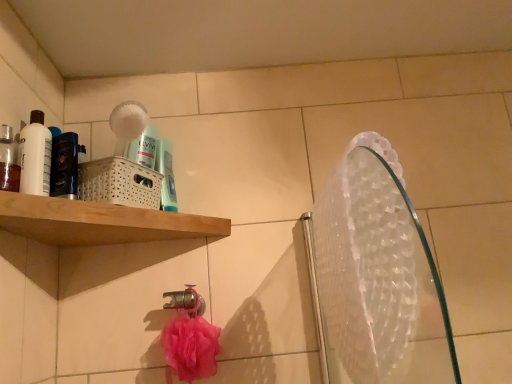
Question: Is translucent plastic mouthwash at left, which appears as the first mouthwash when viewed from the left, positioned with its back to transparent plastic mirror at upper right?

Choices:
 (A) no
 (B) yes

Answer: (A)

Question: Can you confirm if translucent plastic mouthwash at left, which appears as the first mouthwash when viewed from the left, is positioned to the left of transparent plastic mirror at upper right?

Choices:
 (A) yes
 (B) no

Answer: (A)

Question: Is translucent plastic mouthwash at left, which is counted as the 1th mouthwash, starting from the front, outside transparent plastic mirror at upper right?

Choices:
 (A) no
 (B) yes

Answer: (B)

Question: From the image's perspective, does translucent plastic mouthwash at left, which appears as the first mouthwash when viewed from the left, appear higher than transparent plastic mirror at upper right?

Choices:
 (A) no
 (B) yes

Answer: (B)

Question: Can you confirm if translucent plastic mouthwash at left, which appears as the first mouthwash when viewed from the left, is smaller than transparent plastic mirror at upper right?

Choices:
 (A) yes
 (B) no

Answer: (A)

Question: Considering the relative sizes of translucent plastic mouthwash at left, which is counted as the 1th mouthwash, starting from the front, and transparent plastic mirror at upper right in the image provided, is translucent plastic mouthwash at left, which is counted as the 1th mouthwash, starting from the front, wider than transparent plastic mirror at upper right?

Choices:
 (A) yes
 (B) no

Answer: (B)

Question: Does blue glossy mouthwash at upper center, which is counted as the third mouthwash, starting from the left, come behind metallic chrome tap at lower center?

Choices:
 (A) yes
 (B) no

Answer: (B)

Question: From the image's perspective, does blue glossy mouthwash at upper center, which is the first mouthwash in back-to-front order, appear higher than metallic chrome tap at lower center?

Choices:
 (A) yes
 (B) no

Answer: (A)

Question: Is blue glossy mouthwash at upper center, which is counted as the third mouthwash, starting from the left, not within metallic chrome tap at lower center?

Choices:
 (A) no
 (B) yes

Answer: (B)

Question: Is blue glossy mouthwash at upper center, which is the first mouthwash in back-to-front order, to the right of metallic chrome tap at lower center from the viewer's perspective?

Choices:
 (A) no
 (B) yes

Answer: (A)

Question: Does blue glossy mouthwash at upper center, the first mouthwash positioned from the right, have a greater height compared to metallic chrome tap at lower center?

Choices:
 (A) yes
 (B) no

Answer: (A)

Question: Considering the relative sizes of blue glossy mouthwash at upper center, the first mouthwash positioned from the right, and metallic chrome tap at lower center in the image provided, is blue glossy mouthwash at upper center, the first mouthwash positioned from the right, bigger than metallic chrome tap at lower center?

Choices:
 (A) no
 (B) yes

Answer: (A)

Question: Is metallic chrome tap at lower center positioned in front of blue glossy mouthwash at upper center, the first mouthwash positioned from the right?

Choices:
 (A) yes
 (B) no

Answer: (B)